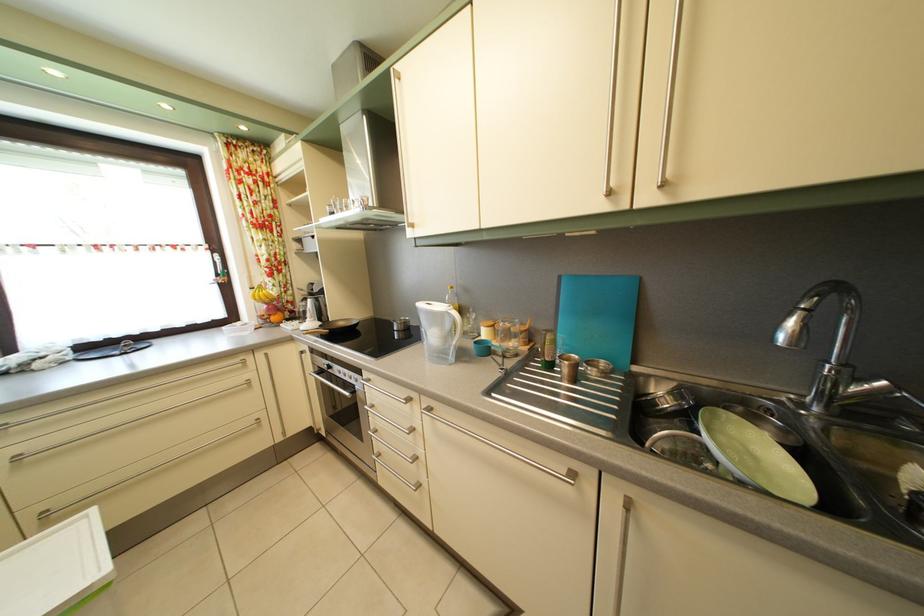
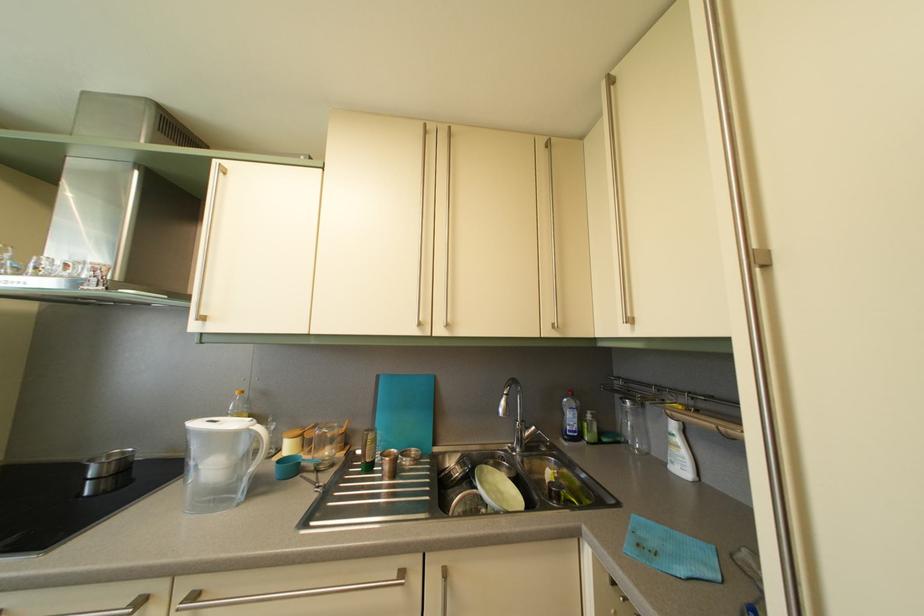
In the second image, find the point that corresponds to pixel 438 416 in the first image.

(202, 604)